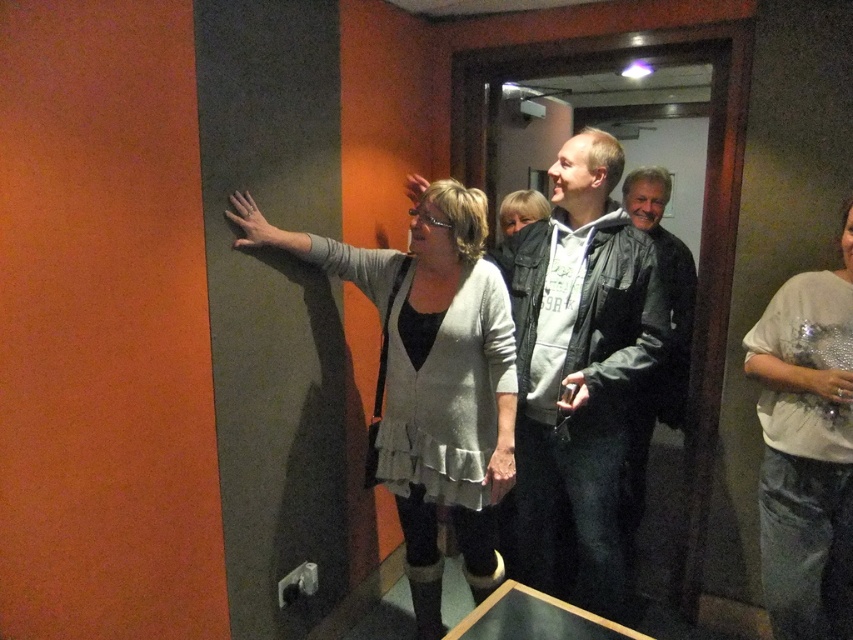
You are standing at the entrance of the room and want to find the gray hoodie at center. Based on the coordinates provided, in which direction should you look to locate it?

The gray hoodie at center is located at coordinates point (579, 378), which is towards the upper right direction from your position at the entrance.

You are standing in the room and want to locate the light gray textured sweater at center. According to the coordinates provided, where would you find it?

The light gray textured sweater at center is located at the 2D coordinates point [431,378].